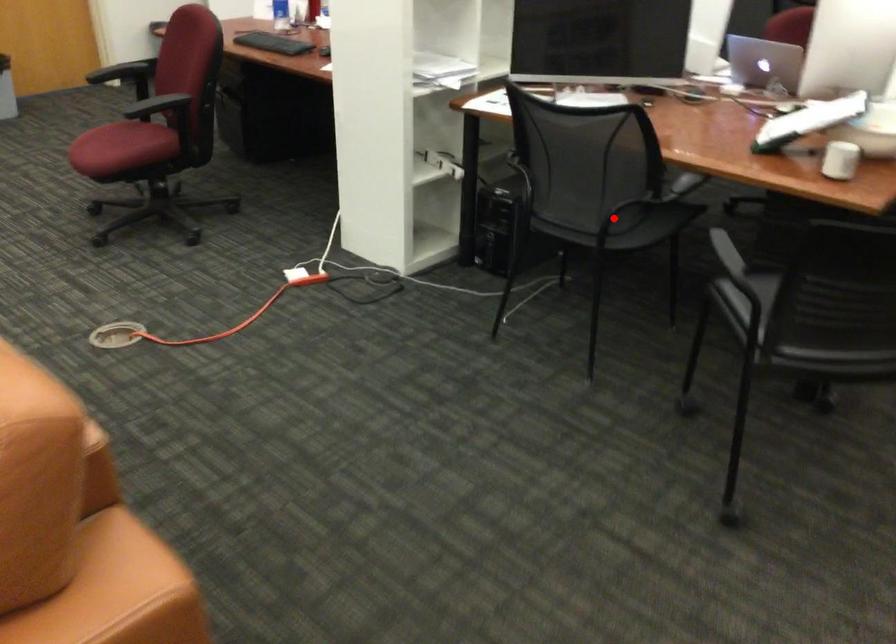
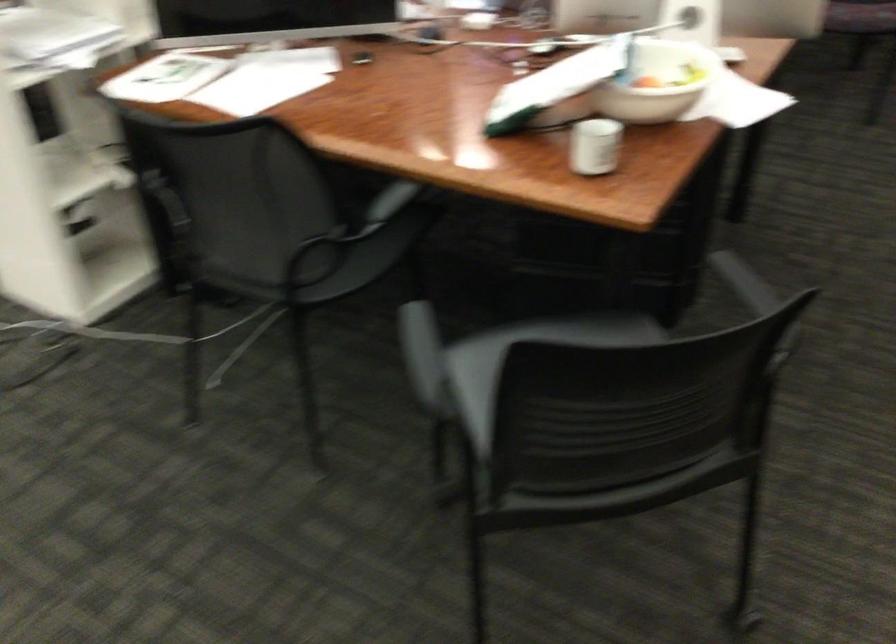
Where in the second image is the point corresponding to the highlighted location from the first image?

(314, 263)